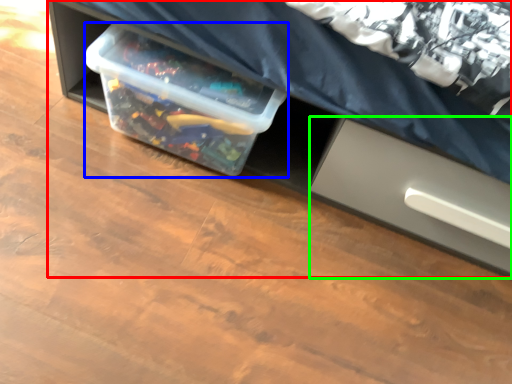
Question: Considering the real-world distances, which object is closest to furniture (highlighted by a red box)? box (highlighted by a blue box) or drawer (highlighted by a green box).

Choices:
 (A) box
 (B) drawer

Answer: (B)